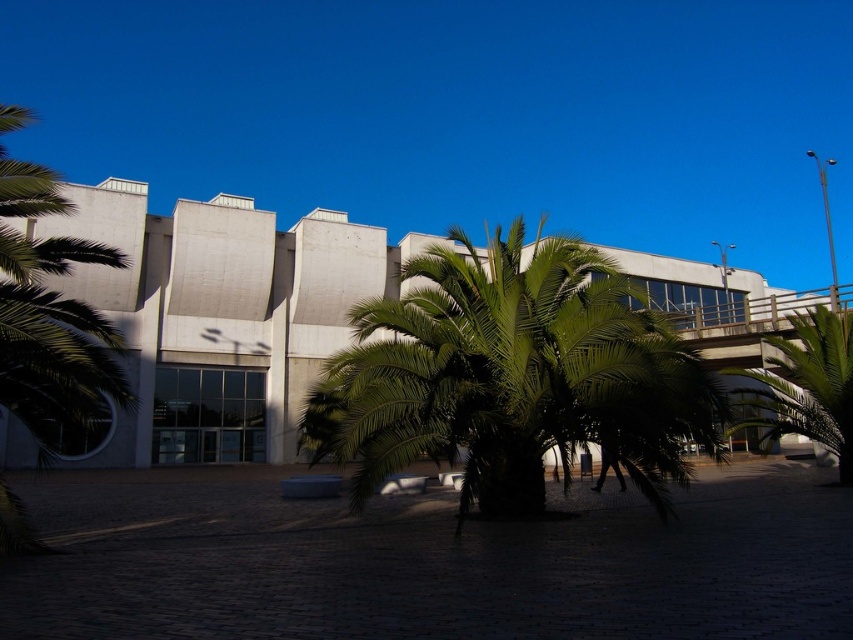
Question: Which point is farther to the camera?

Choices:
 (A) (364, 394)
 (B) (764, 388)

Answer: (B)

Question: Which point appears farthest from the camera in this image?

Choices:
 (A) (566, 317)
 (B) (842, 461)

Answer: (B)

Question: Does green leafy palm tree at center appear on the left side of green leafy palm tree at right?

Choices:
 (A) no
 (B) yes

Answer: (B)

Question: Is green leafy palm tree at center to the left of green leafy palm tree at right from the viewer's perspective?

Choices:
 (A) yes
 (B) no

Answer: (A)

Question: Which point is farther to the camera?

Choices:
 (A) green leafy palm tree at right
 (B) green leafy palm tree at center

Answer: (A)

Question: Can you confirm if green leafy palm tree at center is positioned to the right of green leafy palm tree at right?

Choices:
 (A) yes
 (B) no

Answer: (B)